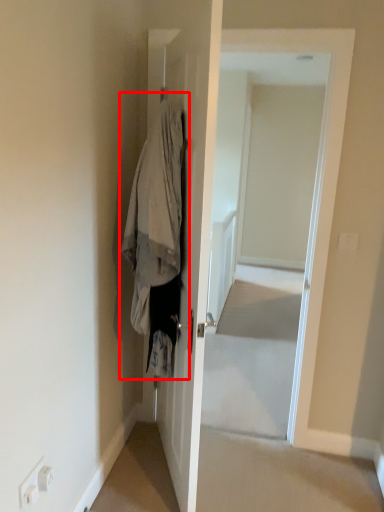
Question: Considering the relative positions of clothing (annotated by the red box) and screen door in the image provided, where is clothing (annotated by the red box) located with respect to the staircase?

Choices:
 (A) left
 (B) right

Answer: (A)